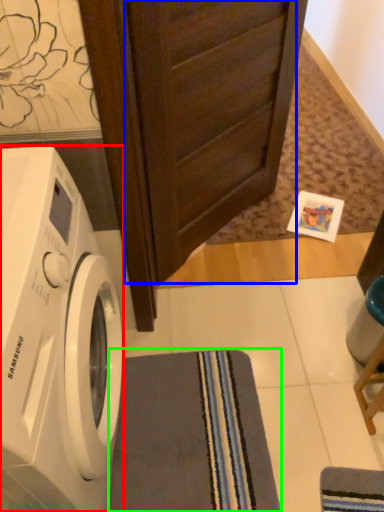
Question: Which is nearer to the washing machine (highlighted by a red box)? screen door (highlighted by a blue box) or bath towel (highlighted by a green box).

Choices:
 (A) screen door
 (B) bath towel

Answer: (B)